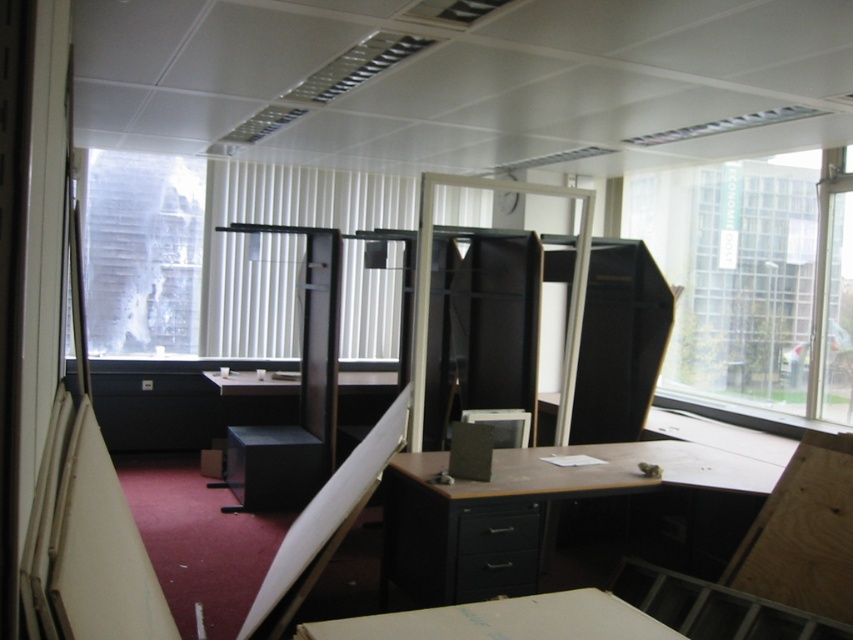
Between transparent glass window at upper right and matte black desk at center, which one is positioned higher?

transparent glass window at upper right

Does point (813, 256) come in front of point (762, 467)?

That is False.

Where is `transparent glass window at upper right`? This screenshot has width=853, height=640. transparent glass window at upper right is located at coordinates (755, 278).

Is the position of transparent glass window at upper right less distant than that of transparent glass window at upper left?

Yes.

From the picture: Is transparent glass window at upper right above transparent glass window at upper left?

No.

Who is more forward, (x=740, y=173) or (x=136, y=330)?

Point (x=740, y=173) is more forward.

Where is `transparent glass window at upper right`? The height and width of the screenshot is (640, 853). transparent glass window at upper right is located at coordinates (755, 278).

This screenshot has width=853, height=640. What do you see at coordinates (526, 506) in the screenshot?
I see `matte black desk at center` at bounding box center [526, 506].

Between matte black desk at center and transparent glass window at upper left, which one appears on the left side from the viewer's perspective?

From the viewer's perspective, transparent glass window at upper left appears more on the left side.

Between point (761, 465) and point (128, 157), which one is positioned behind?

The point (128, 157) is more distant.

Where is `matte black desk at center`? matte black desk at center is located at coordinates (526, 506).